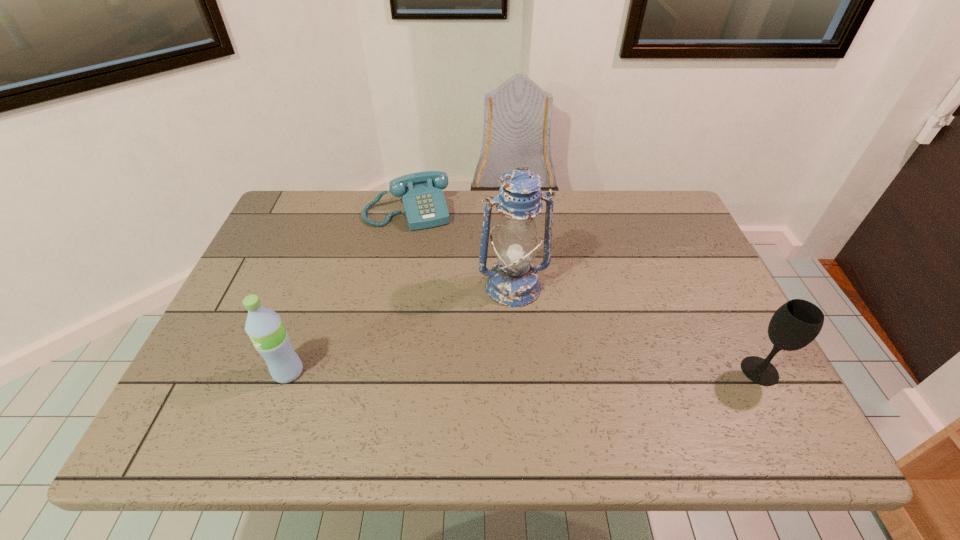
Where is `vacant point located between the second shortest object and the lantern`? This screenshot has width=960, height=540. vacant point located between the second shortest object and the lantern is located at coordinates (636, 329).

This screenshot has width=960, height=540. I want to click on empty location between the leftmost object and the second shortest object, so click(x=524, y=372).

In order to click on vacant region between the second object from left to right and the second object from right to left in this screenshot , I will do `click(460, 248)`.

Locate an element on the screen. The height and width of the screenshot is (540, 960). empty space between the third nearest object and the farthest object is located at coordinates (460, 248).

Image resolution: width=960 pixels, height=540 pixels. What are the coordinates of `vacant space that's between the water bottle and the wineglass` in the screenshot? It's located at (524, 372).

At what (x,y) coordinates should I click in order to perform the action: click on free point between the wineglass and the second farthest object. Please return your answer as a coordinate pair (x, y). The width and height of the screenshot is (960, 540). Looking at the image, I should click on (636, 329).

The image size is (960, 540). Find the location of `unoccupied area between the telephone and the leftmost object`. unoccupied area between the telephone and the leftmost object is located at coordinates (348, 291).

The image size is (960, 540). Find the location of `empty space between the telephone and the tallest object`. empty space between the telephone and the tallest object is located at coordinates (460, 248).

Where is `object that is the nearest to the shortest object`? This screenshot has height=540, width=960. object that is the nearest to the shortest object is located at coordinates (513, 281).

You are a GUI agent. You are given a task and a screenshot of the screen. Output one action in this format:
    pyautogui.click(x=<x>, y=<y>)
    Task: Click on the object that ranks as the closest to the tallest object
    The width and height of the screenshot is (960, 540).
    Given the screenshot: What is the action you would take?
    pyautogui.click(x=422, y=196)